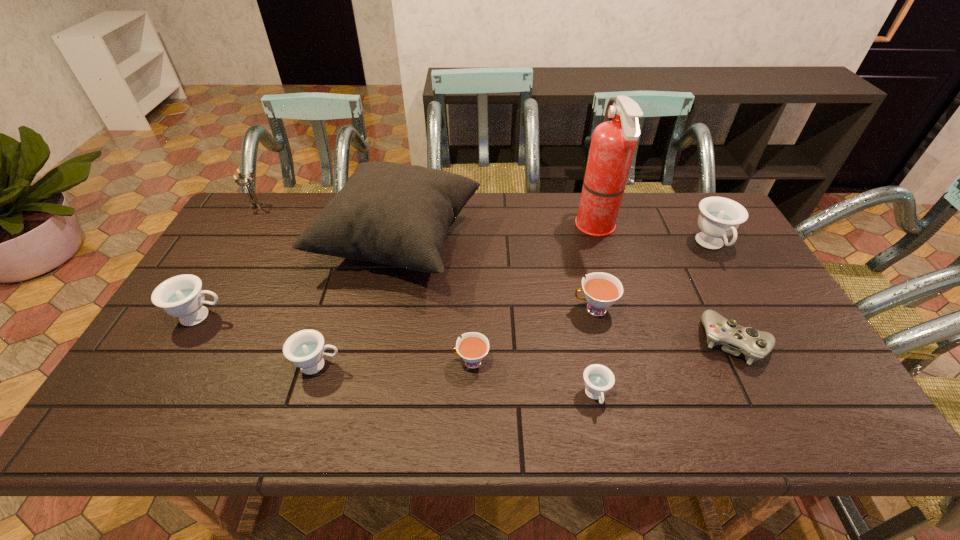
Locate an element on the screen. Image resolution: width=960 pixels, height=540 pixels. vacant area that lies between the smaller white teacup and the candle holder is located at coordinates 364,284.

Where is `free spot between the control and the tallest object`? Image resolution: width=960 pixels, height=540 pixels. free spot between the control and the tallest object is located at coordinates (665, 285).

Locate an element on the screen. The width and height of the screenshot is (960, 540). vacant point located between the control and the fire extinguisher is located at coordinates (665, 285).

Locate an element on the screen. The image size is (960, 540). vacant area between the third blue teacup from left to right and the bigger white teacup is located at coordinates (594, 353).

What are the coordinates of `vacant space in between the red fire extinguisher and the rightmost teacup` in the screenshot? It's located at (654, 237).

Where is `free spot between the biggest blue teacup and the second blue teacup from right to left`? Image resolution: width=960 pixels, height=540 pixels. free spot between the biggest blue teacup and the second blue teacup from right to left is located at coordinates (653, 321).

At what (x,y) coordinates should I click in order to perform the action: click on free space between the cushion and the nearer white teacup. Please return your answer as a coordinate pair (x, y). This screenshot has height=540, width=960. Looking at the image, I should click on click(435, 302).

In order to click on object that is the second closest to the control in this screenshot , I will do `click(719, 217)`.

Image resolution: width=960 pixels, height=540 pixels. Find the location of `the third closest object to the third smallest blue teacup`. the third closest object to the third smallest blue teacup is located at coordinates (254, 201).

Locate which teacup ranks second in proximity to the second blue teacup from left to right. Please provide its 2D coordinates. Your answer should be formatted as a tuple, i.e. [(x, y)], where the tuple contains the x and y coordinates of a point satisfying the conditions above.

[(473, 346)]